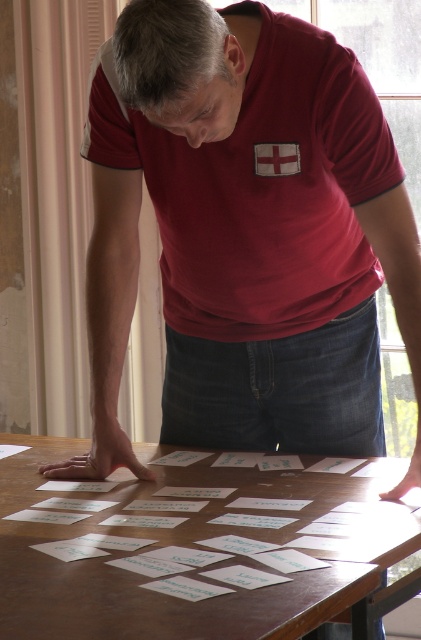
Question: Among these objects, which one is nearest to the camera?

Choices:
 (A) brown wooden table at center
 (B) matte red t-shirt at center

Answer: (A)

Question: Among these points, which one is nearest to the camera?

Choices:
 (A) (178, 291)
 (B) (215, 480)

Answer: (B)

Question: Can you confirm if matte red t-shirt at center is bigger than brown wooden table at center?

Choices:
 (A) no
 (B) yes

Answer: (B)

Question: Is matte red t-shirt at center positioned in front of brown wooden table at center?

Choices:
 (A) yes
 (B) no

Answer: (B)

Question: Does matte red t-shirt at center come behind brown wooden table at center?

Choices:
 (A) no
 (B) yes

Answer: (B)

Question: Which point is closer to the camera?

Choices:
 (A) brown wooden table at center
 (B) matte red t-shirt at center

Answer: (A)